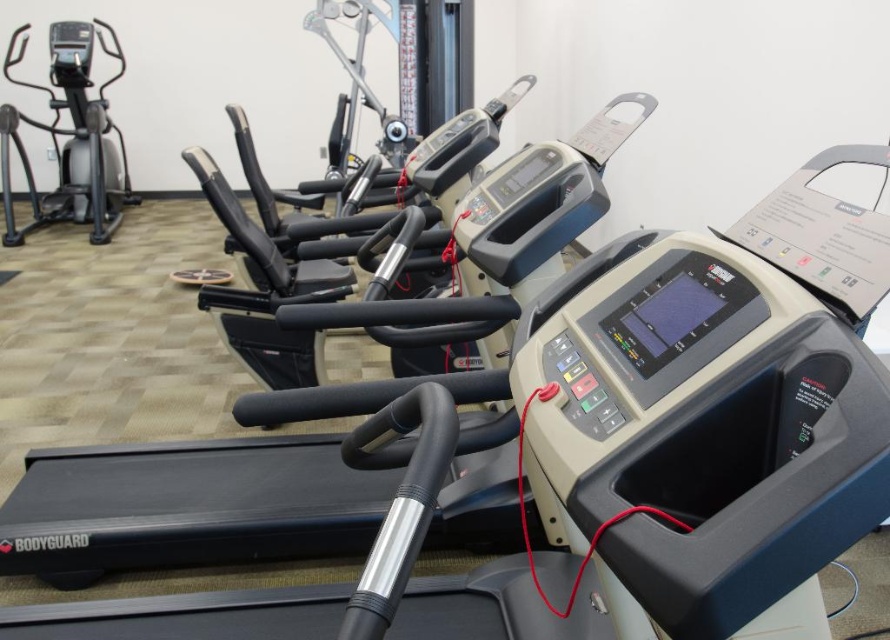
Question: Which of the following is the farthest from the observer?

Choices:
 (A) (494, 472)
 (B) (86, 172)

Answer: (B)

Question: Does black plastic treadmill at center appear on the right side of silver metallic elliptical trainer at left?

Choices:
 (A) yes
 (B) no

Answer: (A)

Question: From the image, what is the correct spatial relationship of black plastic treadmill at center in relation to silver metallic elliptical trainer at left?

Choices:
 (A) left
 (B) right

Answer: (B)

Question: Among these points, which one is nearest to the camera?

Choices:
 (A) (387, 397)
 (B) (20, 236)

Answer: (A)

Question: Does black plastic treadmill at center appear over silver metallic elliptical trainer at left?

Choices:
 (A) no
 (B) yes

Answer: (A)

Question: Which point is farther to the camera?

Choices:
 (A) black plastic treadmill at center
 (B) silver metallic elliptical trainer at left

Answer: (B)